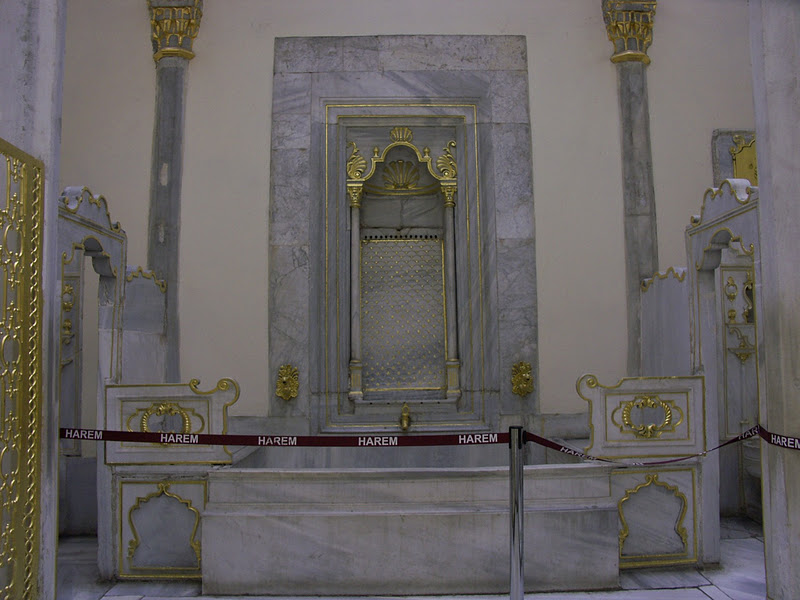
In order to click on marble pillar against wall on left in this screenshot , I will do `click(164, 152)`.